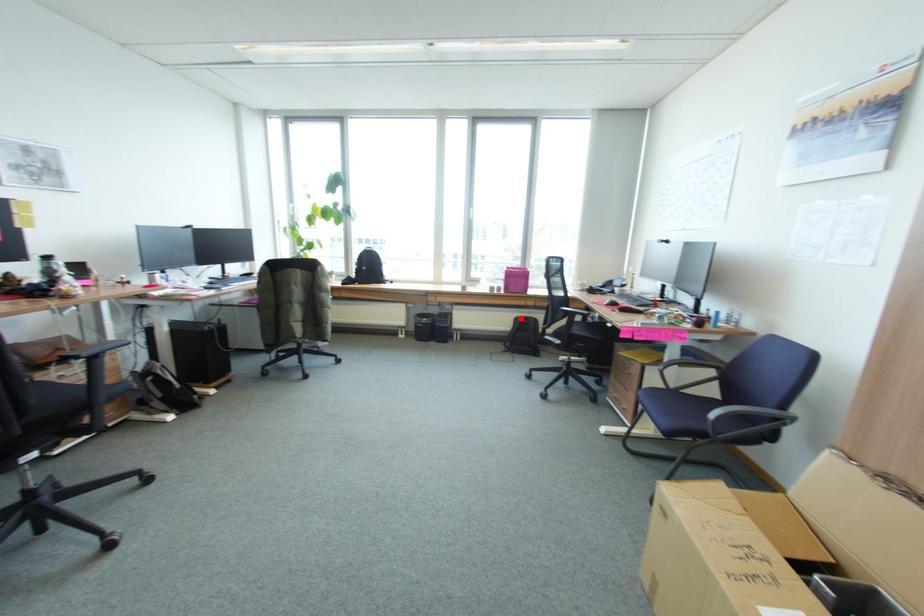
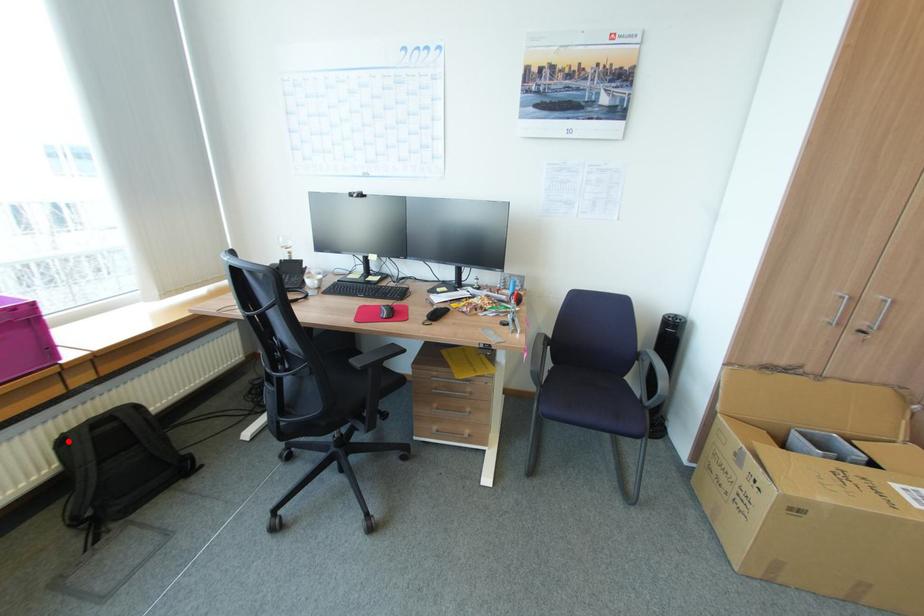
I am providing you with two images of the same scene from different viewpoints. A red point is marked on the first image and another point is marked on the second image. Is the marked point in image1 the same physical position as the marked point in image2?

Yes